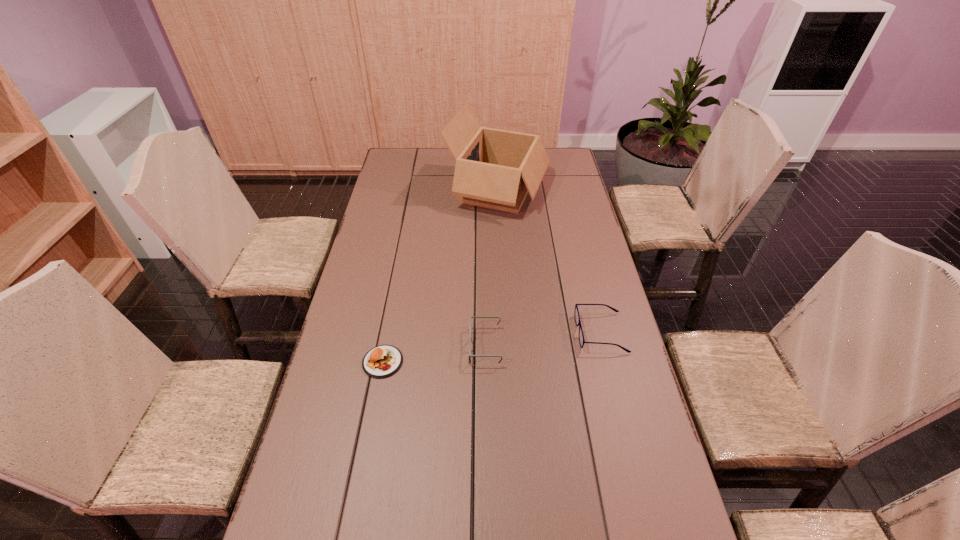
Identify the location of box. Image resolution: width=960 pixels, height=540 pixels. (496, 169).

Where is `the farthest object`? the farthest object is located at coordinates (496, 169).

At what (x,y) coordinates should I click in order to perform the action: click on the left spectacles. Please return your answer as a coordinate pair (x, y). Looking at the image, I should click on (470, 355).

Locate an element on the screen. The height and width of the screenshot is (540, 960). the right spectacles is located at coordinates (576, 313).

Where is `the shortest object`? the shortest object is located at coordinates (382, 361).

Where is `the leftmost object`? This screenshot has width=960, height=540. the leftmost object is located at coordinates (382, 361).

The height and width of the screenshot is (540, 960). What are the coordinates of `free space located 0.180m on the left of the tallest object` in the screenshot? It's located at (403, 189).

In order to click on vacant region located 0.260m on the lens of the left spectacles in this screenshot , I will do `click(379, 346)`.

Locate an element on the screen. The height and width of the screenshot is (540, 960). vacant space located on the lens of the left spectacles is located at coordinates (435, 346).

The image size is (960, 540). I want to click on free space located on the lens of the left spectacles, so click(442, 346).